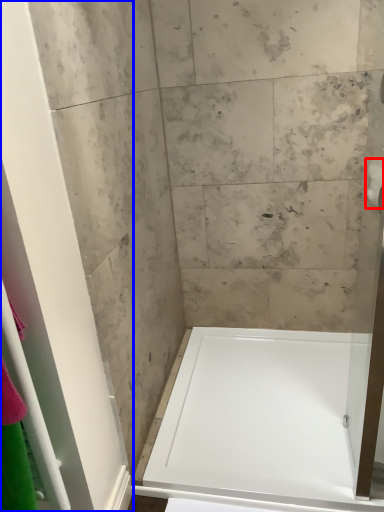
Question: Among these objects, which one is farthest to the camera, toilet paper (highlighted by a red box) or screen door (highlighted by a blue box)?

Choices:
 (A) toilet paper
 (B) screen door

Answer: (A)